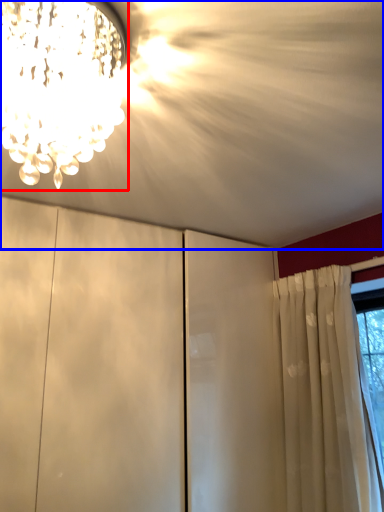
Question: Which of the following is the farthest to the observer, lamp (highlighted by a red box) or cloud (highlighted by a blue box)?

Choices:
 (A) lamp
 (B) cloud

Answer: (A)